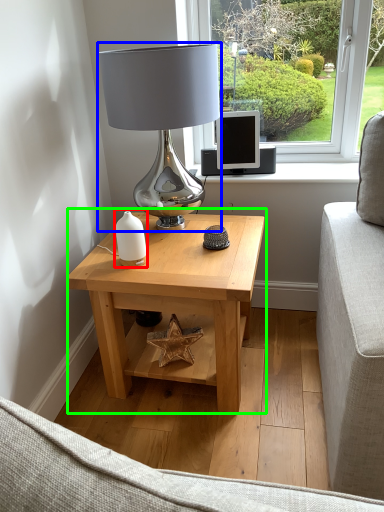
Question: Based on their relative distances, which object is nearer to candle holder (highlighted by a red box)? Choose from table lamp (highlighted by a blue box) and table (highlighted by a green box).

Choices:
 (A) table lamp
 (B) table

Answer: (B)